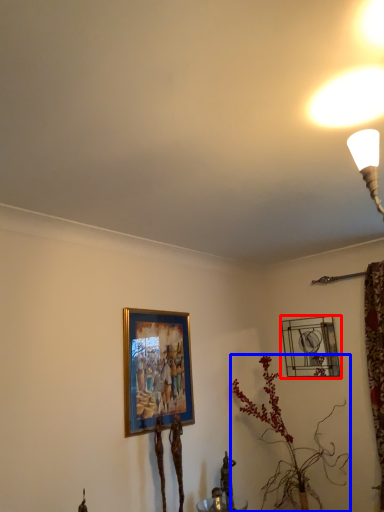
Question: Among these objects, which one is nearest to the camera, picture frame (highlighted by a red box) or houseplant (highlighted by a blue box)?

Choices:
 (A) picture frame
 (B) houseplant

Answer: (B)